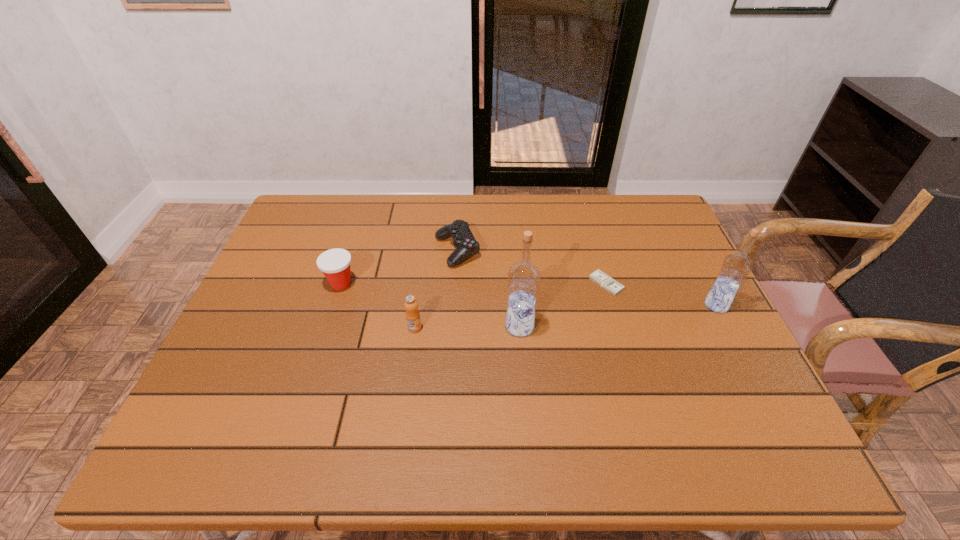
Find the location of a particular element. Image resolution: width=960 pixels, height=540 pixels. the fourth shortest object is located at coordinates (412, 314).

Where is `the second object from left to right`? the second object from left to right is located at coordinates (412, 314).

Find the location of `vacant space situated on the left of the tallest object`. vacant space situated on the left of the tallest object is located at coordinates (425, 326).

This screenshot has width=960, height=540. What are the coordinates of `free region located 0.310m on the left of the second tallest object` in the screenshot? It's located at 588,305.

The height and width of the screenshot is (540, 960). In order to click on free space located 0.050m on the right of the money in this screenshot , I will do `click(640, 284)`.

Where is `vacant space located on the front of the third shortest object`? vacant space located on the front of the third shortest object is located at coordinates (329, 320).

Identify the location of vacant area situated on the right of the fourth object from right to left. (553, 251).

You are a GUI agent. You are given a task and a screenshot of the screen. Output one action in this format:
    pyautogui.click(x=<x>, y=<y>)
    Task: Click on the free space located on the front label of the orange juice
    
    Given the screenshot: What is the action you would take?
    pyautogui.click(x=410, y=364)

Where is `object that is at the far edge`? This screenshot has height=540, width=960. object that is at the far edge is located at coordinates (464, 241).

Identify the location of object present at the right edge. (735, 268).